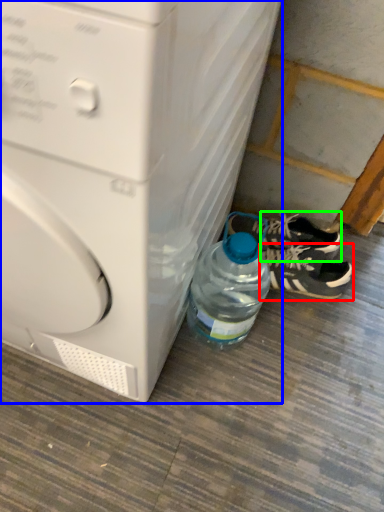
Question: Estimate the real-world distances between objects in this image. Which object is closer to footwear (highlighted by a red box), washing machine (highlighted by a blue box) or sneakers (highlighted by a green box)?

Choices:
 (A) washing machine
 (B) sneakers

Answer: (B)